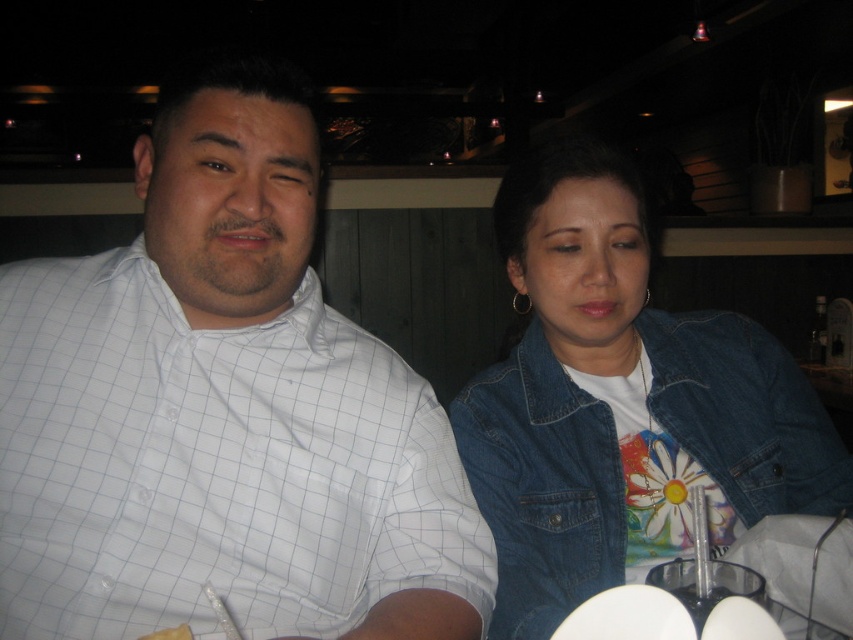
You are standing in the restaurant and want to know which of the two points, point (39, 339) or point (554, 378), is closer to you. Based on the scene description, which point is nearer?

Point (39, 339) is closer to the viewer than point (554, 378).

You are a photographer setting up a shoot in this dining area. You need to position a light source so that it illuminates both the white checkered shirt at left and the faded denim jacket at lower right equally. Considering their heights, which object should be placed closer to the light source?

The faded denim jacket at lower right should be placed closer to the light source because it has a shorter height compared to the white checkered shirt at left, ensuring both receive equal illumination.

Based on the photo, you are a photographer trying to capture a candid shot of both the white checkered shirt at left and the faded denim jacket at lower right. Since you can only focus on one subject at a time, which one should you choose to ensure the other remains in the background?

You should focus on the white checkered shirt at left because it is closer to the viewer, allowing the faded denim jacket at lower right to naturally fall into the background.